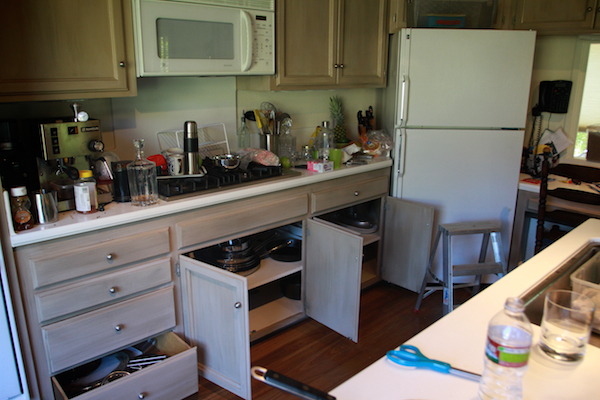
You are a GUI agent. You are given a task and a screenshot of the screen. Output one action in this format:
    pyautogui.click(x=<x>, y=<y>)
    Task: Click on the wall-mounted phone with cord
    
    Given the screenshot: What is the action you would take?
    pyautogui.click(x=566, y=87), pyautogui.click(x=547, y=86), pyautogui.click(x=565, y=102), pyautogui.click(x=554, y=107), pyautogui.click(x=553, y=97), pyautogui.click(x=542, y=107), pyautogui.click(x=534, y=119), pyautogui.click(x=531, y=132), pyautogui.click(x=528, y=149)